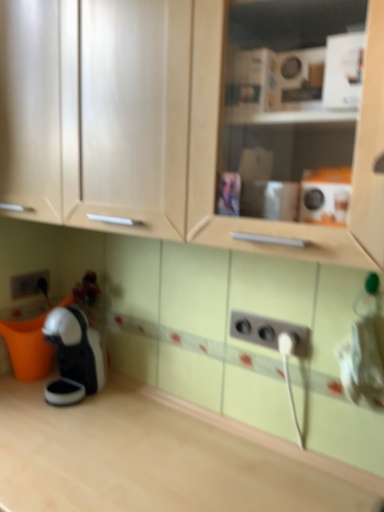
Identify the location of free point in front of black plastic coffee machine at lower left. The height and width of the screenshot is (512, 384). (62, 422).